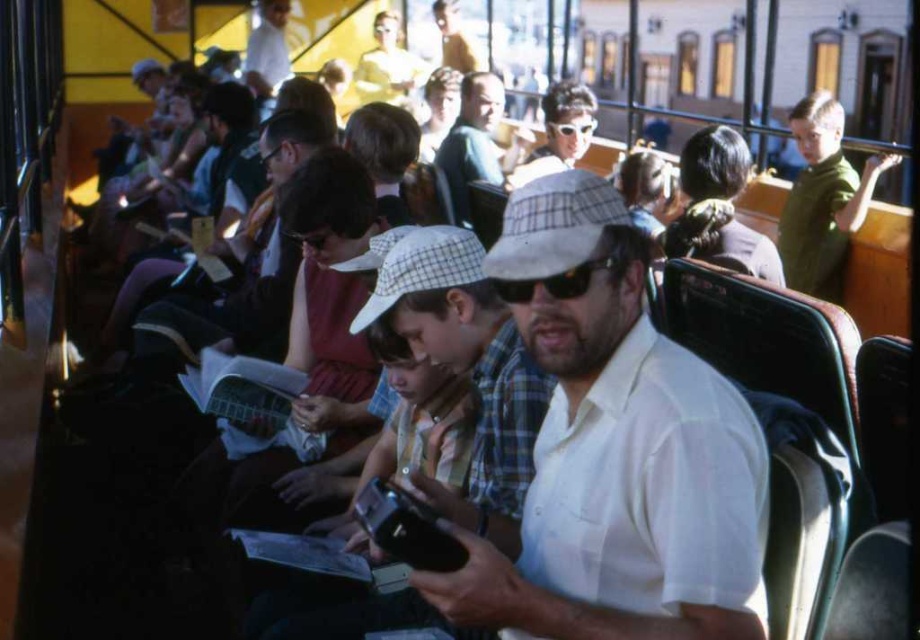
You are standing in the bus and want to take a photo of the white checkered baseball cap at center. Where should you position yourself to capture it in the center of your camera viewfinder?

To capture the white checkered baseball cap at center in the center of your camera viewfinder, position yourself directly in front of it, aligning the camera lens with the coordinates provided at point (422,268). This ensures the subject is centered in your shot.

You are standing in the middle of the bus and see the white checkered baseball cap at center. If you want to reach it, how many steps would you need to take if each step is 2.5 feet?

The white checkered baseball cap at center is 8.65 feet away from viewer. Since each step is 2.5 feet, you would need approximately 4 steps to reach it because 8.65 divided by 2.5 is about 3.46, which rounds up to 4 steps.

You are a photographer standing in the bus and you see both the white checkered baseball hat at center and the white checkered baseball cap at center. Which one is taller?

The white checkered baseball cap at center is taller than the white checkered baseball hat at center.